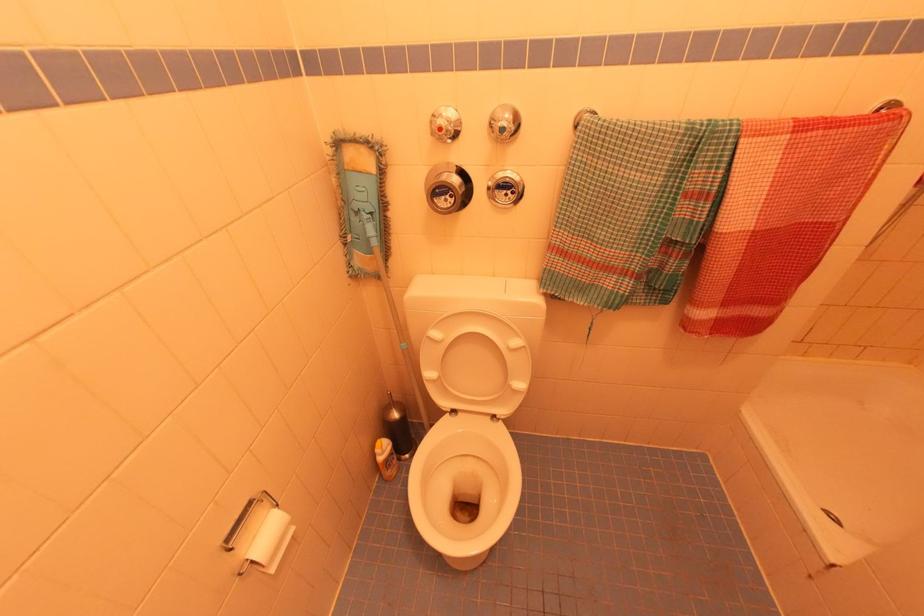
Identify the location of silver toilet brush handle. 447,188.